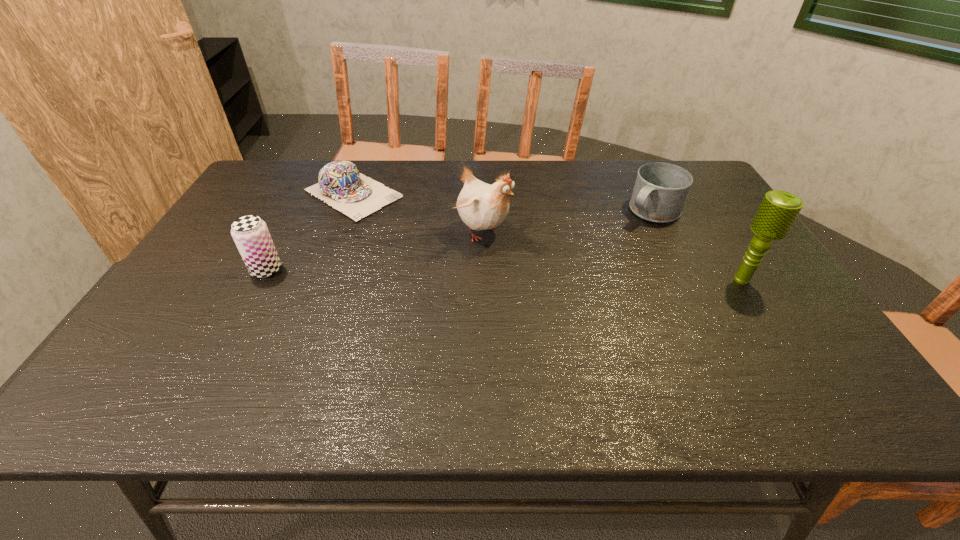
The image size is (960, 540). I want to click on free space on the desktop that is between the third tallest object and the rightmost object and is positioned on the side of the fourth object from left to right with the handle, so click(572, 276).

Identify the location of free space on the desktop that is between the beer can and the microphone and is positioned on the front, side, and top of the shortest object. (495, 275).

Identify the location of vacant spot on the desktop that is between the third tallest object and the rightmost object and is positioned at the beak of the third object from left to right. (566, 276).